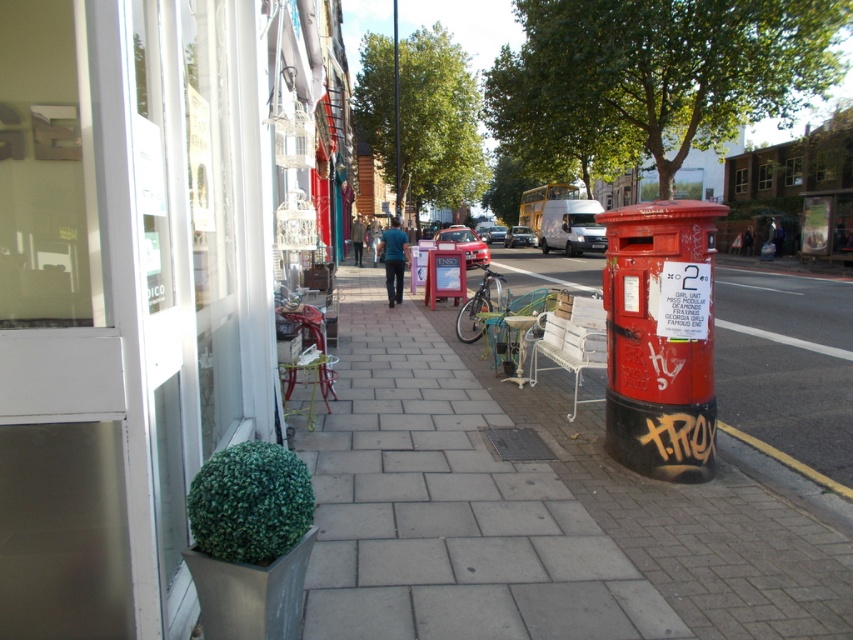
You are a delivery person trying to navigate through the sidewalk in the European city street scene. You need to pass between the green matte plant at lower left and the yellow rubber at lower right. Can you estimate if there is enough vertical clearance for your 1.8 meters tall delivery box?

The green matte plant at lower left has a greater height compared to yellow rubber at lower right. Since the tallest object between them is the green matte plant at lower left, and it is not specified to exceed 1.8 meters, there might be sufficient vertical clearance. However, without exact height measurements, this is an approximation.